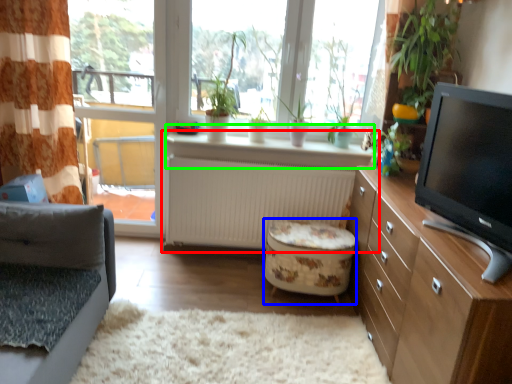
Question: Which object is the farthest from desk (highlighted by a red box)? Choose among these: stool (highlighted by a blue box) or window sill (highlighted by a green box).

Choices:
 (A) stool
 (B) window sill

Answer: (A)